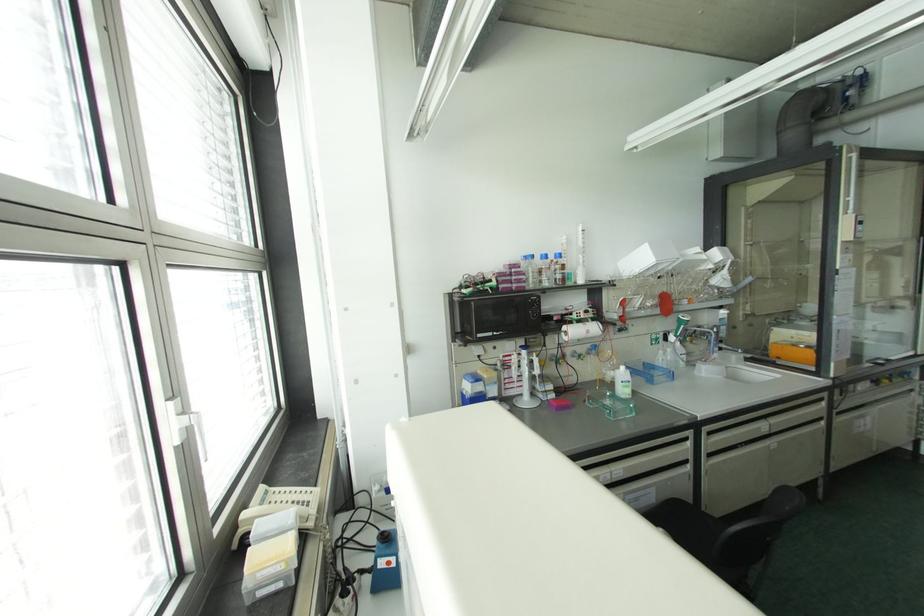
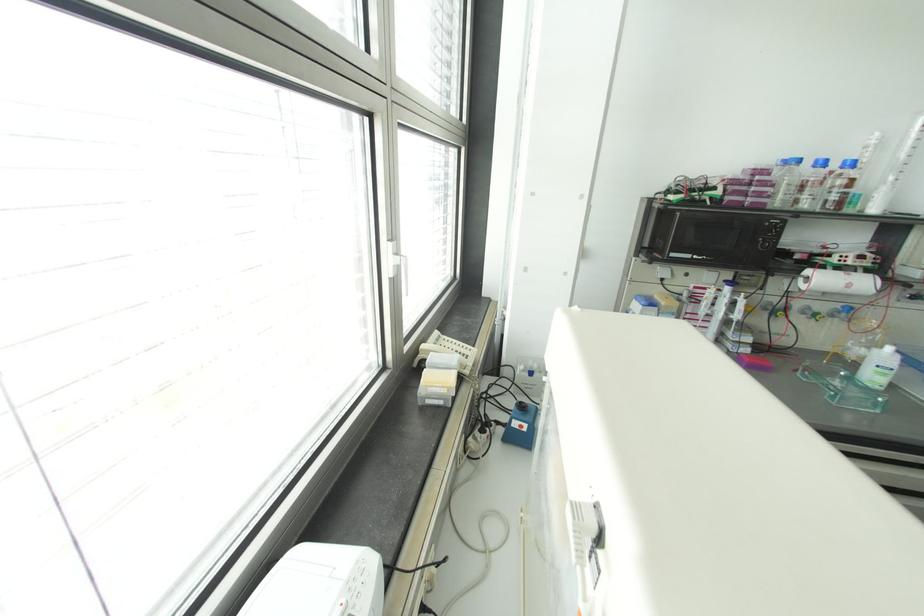
The point at (514,371) is marked in the first image. Where is the corresponding point in the second image?

(702, 309)